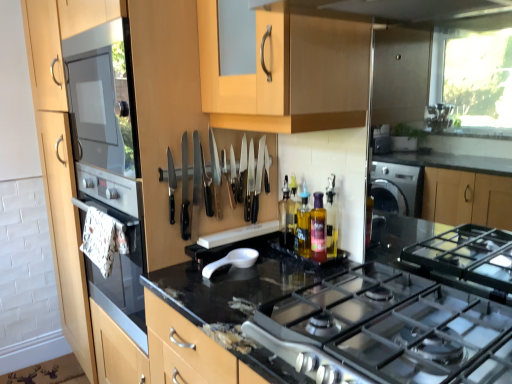
Question: From a real-world perspective, is white matte spoon at center positioned under black plastic knives at center based on gravity?

Choices:
 (A) no
 (B) yes

Answer: (B)

Question: From the image's perspective, is white matte spoon at center on black plastic knives at center?

Choices:
 (A) no
 (B) yes

Answer: (A)

Question: Is white matte spoon at center not inside black plastic knives at center?

Choices:
 (A) no
 (B) yes

Answer: (B)

Question: Is white matte spoon at center facing away from black plastic knives at center?

Choices:
 (A) yes
 (B) no

Answer: (B)

Question: Is black plastic knives at center located within white matte spoon at center?

Choices:
 (A) no
 (B) yes

Answer: (A)

Question: In the image, is translucent plastic bottle at center, which is the 3th bottle in front-to-back order, on the left side or the right side of black granite countertop at center?

Choices:
 (A) right
 (B) left

Answer: (A)

Question: In terms of size, does translucent plastic bottle at center, which is counted as the 1th bottle, starting from the back, appear bigger or smaller than black granite countertop at center?

Choices:
 (A) big
 (B) small

Answer: (B)

Question: From the image's perspective, is translucent plastic bottle at center, which is the 3th bottle in front-to-back order, positioned above or below black granite countertop at center?

Choices:
 (A) below
 (B) above

Answer: (B)

Question: Is point (284, 201) closer or farther from the camera than point (228, 284)?

Choices:
 (A) closer
 (B) farther

Answer: (B)

Question: Relative to translucent purple bottle at center, which is counted as the 2th bottle, starting from the back, is black granite countertop at center in front or behind?

Choices:
 (A) front
 (B) behind

Answer: (A)

Question: From a real-world perspective, is black granite countertop at center above or below translucent purple bottle at center, acting as the 2th bottle starting from the front?

Choices:
 (A) below
 (B) above

Answer: (A)

Question: From the image's perspective, is black granite countertop at center positioned above or below translucent purple bottle at center, acting as the 2th bottle starting from the front?

Choices:
 (A) above
 (B) below

Answer: (B)

Question: Looking at their shapes, would you say black granite countertop at center is wider or thinner than translucent purple bottle at center, acting as the 2th bottle starting from the front?

Choices:
 (A) thin
 (B) wide

Answer: (B)

Question: Relative to translucent plastic bottle at center, which is counted as the 1th bottle, starting from the back, is white matte spoon at center in front or behind?

Choices:
 (A) front
 (B) behind

Answer: (A)

Question: Is white matte spoon at center situated inside translucent plastic bottle at center, which is counted as the 1th bottle, starting from the back, or outside?

Choices:
 (A) inside
 (B) outside

Answer: (B)